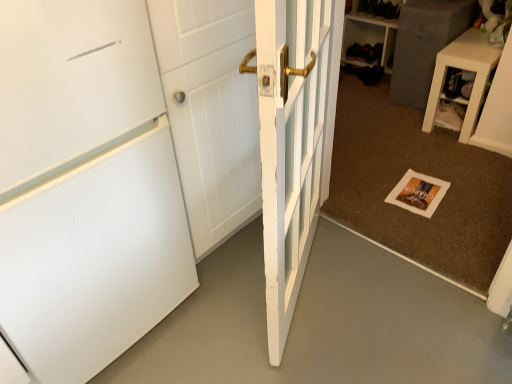
Question: Is white matte refrigerator at left oriented away from white glossy side table at upper right?

Choices:
 (A) yes
 (B) no

Answer: (B)

Question: From the image's perspective, would you say white matte refrigerator at left is shown under white glossy side table at upper right?

Choices:
 (A) yes
 (B) no

Answer: (A)

Question: Can you confirm if white matte refrigerator at left is wider than white glossy side table at upper right?

Choices:
 (A) yes
 (B) no

Answer: (A)

Question: From a real-world perspective, does white matte refrigerator at left stand above white glossy side table at upper right?

Choices:
 (A) no
 (B) yes

Answer: (A)

Question: Considering the relative sizes of white matte refrigerator at left and white glossy side table at upper right in the image provided, is white matte refrigerator at left thinner than white glossy side table at upper right?

Choices:
 (A) yes
 (B) no

Answer: (B)

Question: Considering the relative positions of white matte refrigerator at left and black leather shoe at upper center in the image provided, is white matte refrigerator at left to the left or to the right of black leather shoe at upper center?

Choices:
 (A) right
 (B) left

Answer: (B)

Question: Is point (382, 327) closer or farther from the camera than point (375, 49)?

Choices:
 (A) farther
 (B) closer

Answer: (B)

Question: Is white matte refrigerator at left inside or outside of black leather shoe at upper center?

Choices:
 (A) inside
 (B) outside

Answer: (B)

Question: From a real-world perspective, is white matte refrigerator at left physically located above or below black leather shoe at upper center?

Choices:
 (A) above
 (B) below

Answer: (B)

Question: In the image, is white glossy side table at upper right positioned in front of or behind white matte door at left, marked as the first door in a left-to-right arrangement?

Choices:
 (A) behind
 (B) front

Answer: (A)

Question: Is point (x=431, y=86) closer or farther from the camera than point (x=9, y=278)?

Choices:
 (A) farther
 (B) closer

Answer: (A)

Question: Do you think white glossy side table at upper right is within white matte door at left, marked as the first door in a left-to-right arrangement, or outside of it?

Choices:
 (A) inside
 (B) outside

Answer: (B)

Question: Is white glossy side table at upper right wider or thinner than white matte door at left, marked as the first door in a left-to-right arrangement?

Choices:
 (A) wide
 (B) thin

Answer: (B)

Question: Considering the positions of black leather shoe at upper center and white matte door at left, marked as the first door in a left-to-right arrangement, in the image, is black leather shoe at upper center bigger or smaller than white matte door at left, marked as the first door in a left-to-right arrangement,?

Choices:
 (A) big
 (B) small

Answer: (B)

Question: In terms of height, does black leather shoe at upper center look taller or shorter compared to white matte door at left, marked as the first door in a left-to-right arrangement?

Choices:
 (A) tall
 (B) short

Answer: (B)